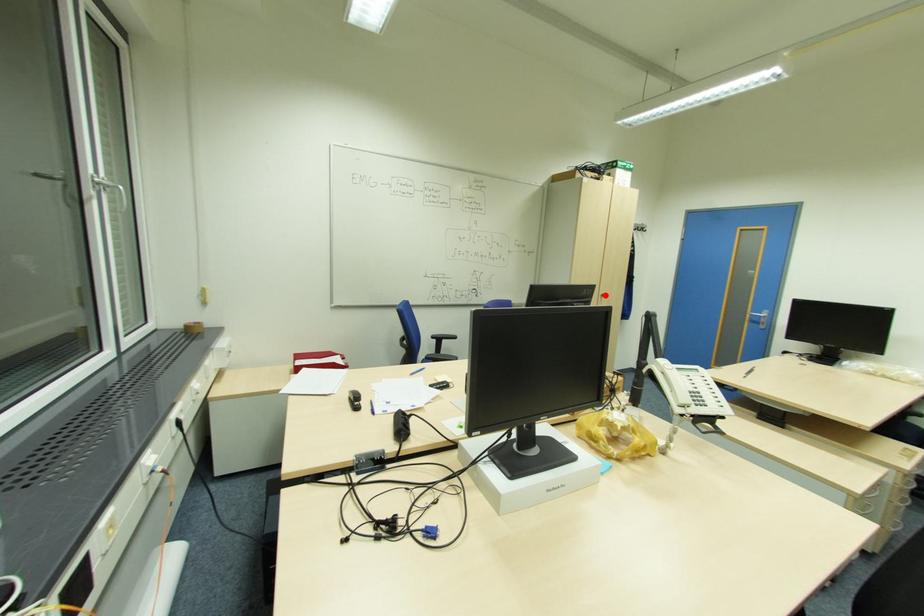
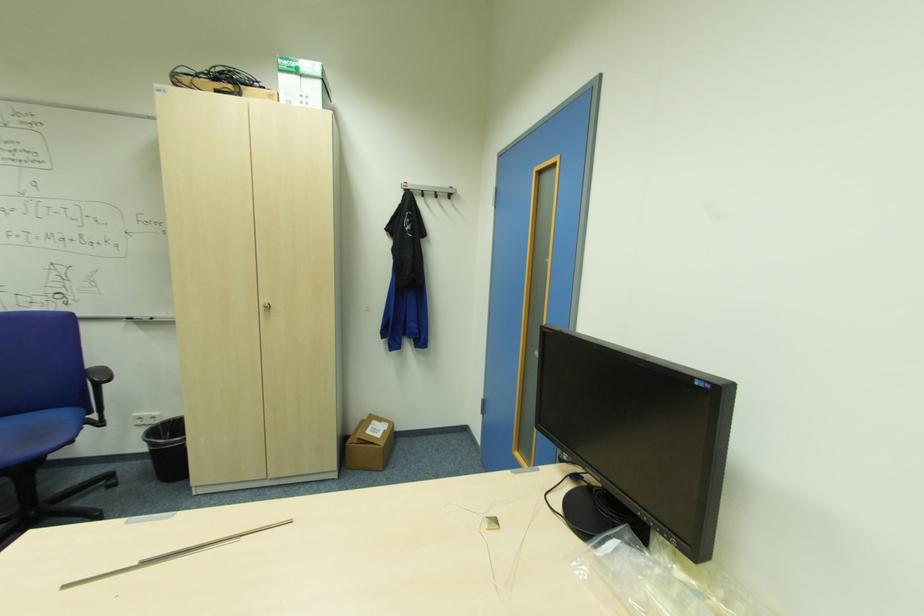
Question: I am providing you with two images of the same scene from different viewpoints. In image1, a red point is highlighted. Considering the same 3D point in image2, which of the following is correct?

Choices:
 (A) It is closer
 (B) It is farther

Answer: (A)